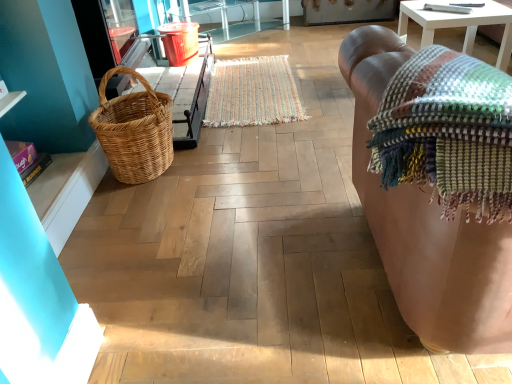
Question: Considering the relative positions of multicolored woven blanket at right and leather couch at right in the image provided, is multicolored woven blanket at right to the left or to the right of leather couch at right?

Choices:
 (A) right
 (B) left

Answer: (B)

Question: Is multicolored woven blanket at right spatially inside leather couch at right, or outside of it?

Choices:
 (A) outside
 (B) inside

Answer: (B)

Question: Estimate the real-world distances between objects in this image. Which object is farther from the woven natural picnic basket at left?

Choices:
 (A) multicolored woven blanket at right
 (B) leather couch at right
 (C) multicolored woven mat at center

Answer: (A)

Question: Which object is the farthest from the multicolored woven mat at center?

Choices:
 (A) multicolored woven blanket at right
 (B) woven natural picnic basket at left
 (C) leather couch at right

Answer: (A)